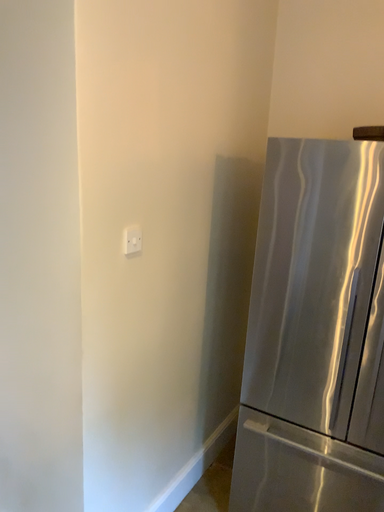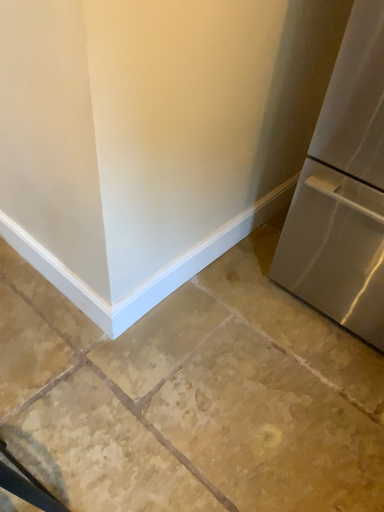
Question: Which way did the camera rotate in the video?

Choices:
 (A) rotated right
 (B) rotated left

Answer: (B)